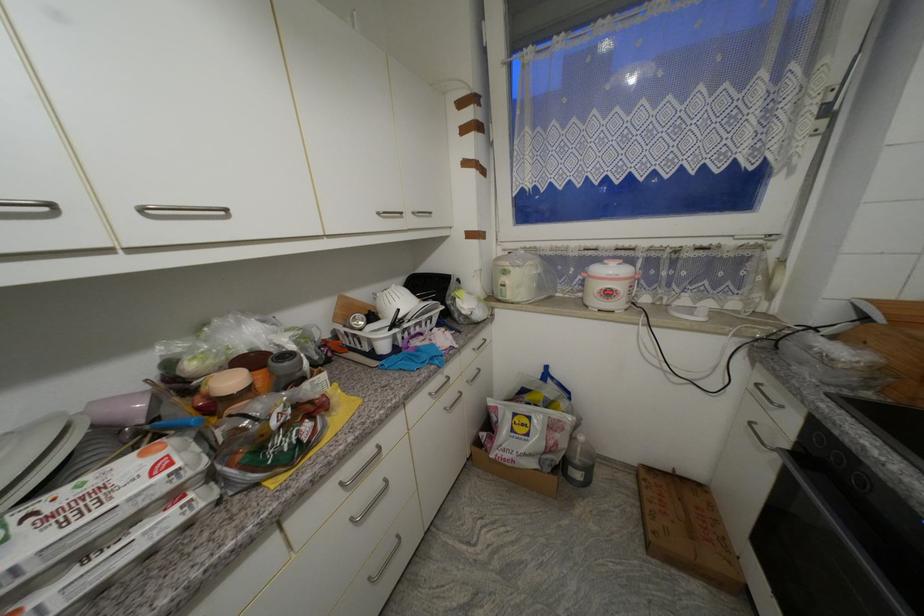
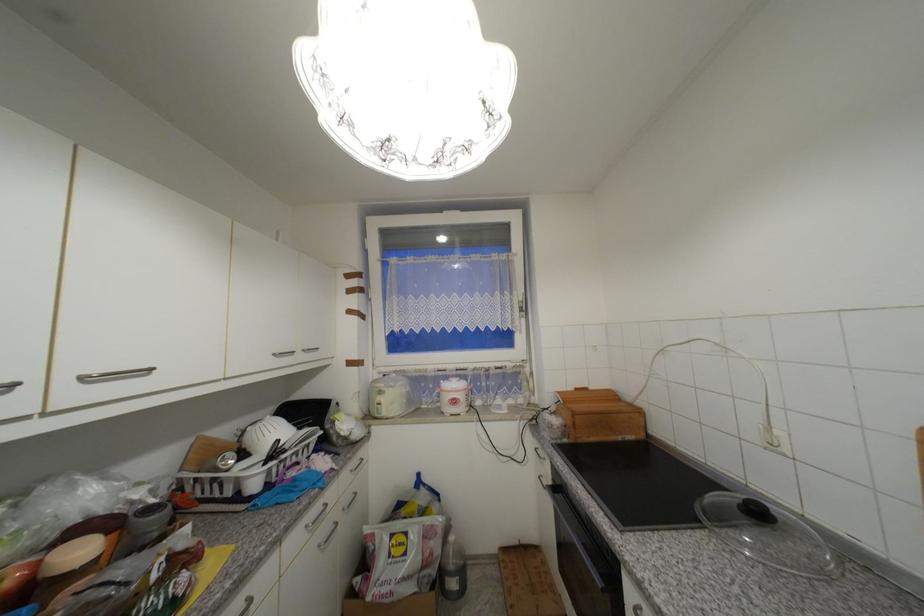
The point at (478, 339) is marked in the first image. Where is the corresponding point in the second image?

(357, 460)